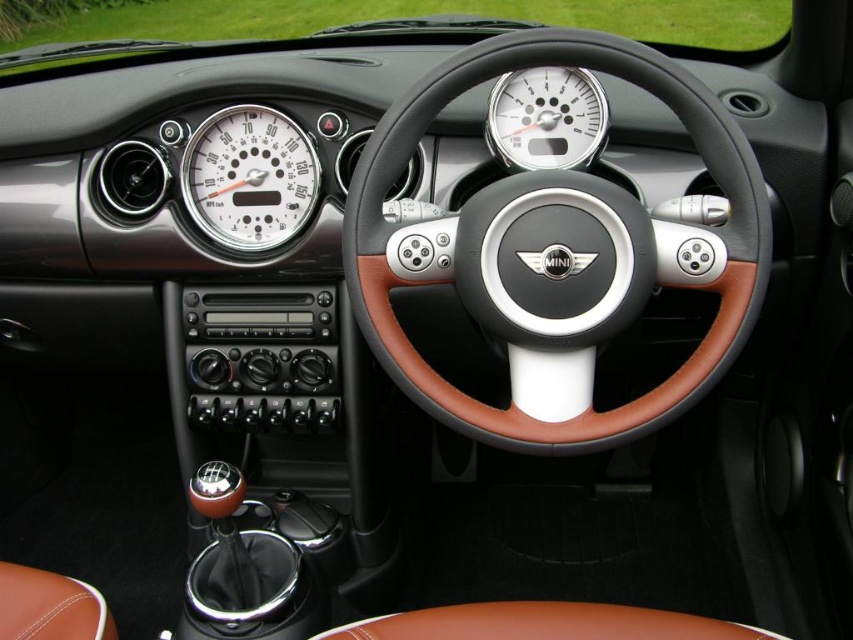
Question: Among these points, which one is nearest to the camera?

Choices:
 (A) (570, 417)
 (B) (212, 122)

Answer: (A)

Question: Is brown leather steering wheel at center smaller than white metallic speedometer at center?

Choices:
 (A) yes
 (B) no

Answer: (B)

Question: Is white glossy speedometer at center behind white metallic speedometer at center?

Choices:
 (A) yes
 (B) no

Answer: (A)

Question: Does brown leather steering wheel at center appear over white metallic speedometer at center?

Choices:
 (A) no
 (B) yes

Answer: (A)

Question: Which object is farther from the camera taking this photo?

Choices:
 (A) white glossy speedometer at center
 (B) white metallic speedometer at center

Answer: (A)

Question: Which point is farther from the camera taking this photo?

Choices:
 (A) (531, 140)
 (B) (708, 257)

Answer: (A)